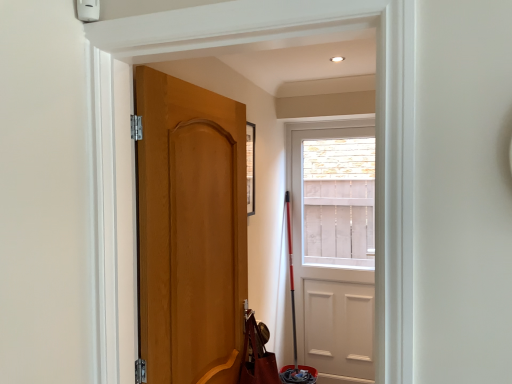
Question: Which direction should I rotate to look at matte wood door at center, which is the second door from right to left, — up or down?

Choices:
 (A) down
 (B) up

Answer: (A)

Question: Is white matte door at center, the 1th door when ordered from right to left, completely or partially inside brown leather shoulder bag at lower left?

Choices:
 (A) no
 (B) yes

Answer: (A)

Question: Considering the relative sizes of brown leather shoulder bag at lower left and white matte door at center, which is counted as the 2th door, starting from the left, in the image provided, is brown leather shoulder bag at lower left wider than white matte door at center, which is counted as the 2th door, starting from the left,?

Choices:
 (A) no
 (B) yes

Answer: (B)

Question: From the image's perspective, is brown leather shoulder bag at lower left over white matte door at center, which appears as the 1th door when viewed from the back?

Choices:
 (A) no
 (B) yes

Answer: (A)

Question: Considering the relative sizes of brown leather shoulder bag at lower left and white matte door at center, which is counted as the 2th door, starting from the left, in the image provided, is brown leather shoulder bag at lower left thinner than white matte door at center, which is counted as the 2th door, starting from the left,?

Choices:
 (A) no
 (B) yes

Answer: (A)

Question: Does brown leather shoulder bag at lower left have a smaller size compared to white matte door at center, the 1th door when ordered from right to left?

Choices:
 (A) no
 (B) yes

Answer: (B)

Question: Is white matte door at center, the 1th door when ordered from right to left, at the back of brown leather shoulder bag at lower left?

Choices:
 (A) yes
 (B) no

Answer: (B)

Question: Can you confirm if matte wood door at center, which ranks as the second door in back-to-front order, is positioned to the right of brown leather shoulder bag at lower left?

Choices:
 (A) no
 (B) yes

Answer: (A)

Question: Considering the relative positions of matte wood door at center, positioned as the first door in front-to-back order, and brown leather shoulder bag at lower left in the image provided, is matte wood door at center, positioned as the first door in front-to-back order, behind brown leather shoulder bag at lower left?

Choices:
 (A) yes
 (B) no

Answer: (B)

Question: Is matte wood door at center, which ranks as the second door in back-to-front order, outside brown leather shoulder bag at lower left?

Choices:
 (A) yes
 (B) no

Answer: (A)

Question: Considering the relative sizes of matte wood door at center, which ranks as the second door in back-to-front order, and brown leather shoulder bag at lower left in the image provided, is matte wood door at center, which ranks as the second door in back-to-front order, smaller than brown leather shoulder bag at lower left?

Choices:
 (A) no
 (B) yes

Answer: (A)

Question: From a real-world perspective, is matte wood door at center, which is the first door in left-to-right order, positioned over brown leather shoulder bag at lower left based on gravity?

Choices:
 (A) no
 (B) yes

Answer: (B)

Question: Could brown leather shoulder bag at lower left be considered to be inside matte wood door at center, which is the first door in left-to-right order?

Choices:
 (A) no
 (B) yes

Answer: (A)

Question: Does white matte door at center, which appears as the 1th door when viewed from the back, have a smaller size compared to brown leather shoulder bag at lower left?

Choices:
 (A) yes
 (B) no

Answer: (B)